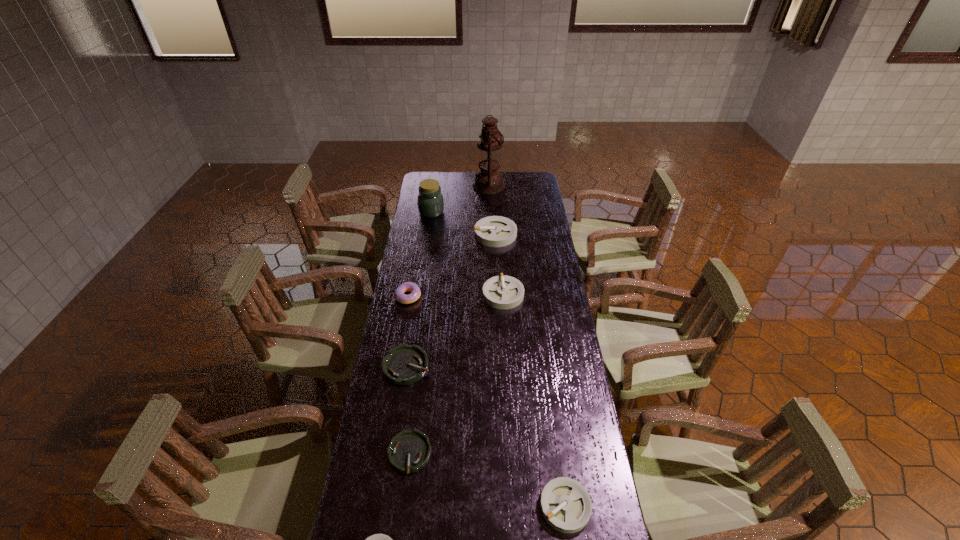
Image resolution: width=960 pixels, height=540 pixels. What are the coordinates of `vacant region located on the left of the second smallest gray ashtray` in the screenshot? It's located at (453, 506).

Find the location of a particular element. The image size is (960, 540). vacant space located on the front of the third farthest ashtray is located at coordinates (401, 401).

Locate an element on the screen. vacant space located 0.080m on the front of the third nearest object is located at coordinates (403, 505).

Locate an element on the screen. object that is at the far edge is located at coordinates (488, 181).

Locate an element on the screen. This screenshot has height=540, width=960. jar situated at the left edge is located at coordinates (430, 200).

The image size is (960, 540). In order to click on doughnut situated at the left edge in this screenshot , I will do tap(411, 287).

Image resolution: width=960 pixels, height=540 pixels. I want to click on object at the right edge, so click(566, 506).

Where is `free spot at the far edge of the desktop`? free spot at the far edge of the desktop is located at coordinates click(x=505, y=187).

Find the location of a particular element. vacant position at the left edge of the desktop is located at coordinates (409, 243).

At what (x,y) coordinates should I click in order to perform the action: click on vacant space at the right edge. Please return your answer as a coordinate pair (x, y). Image resolution: width=960 pixels, height=540 pixels. Looking at the image, I should click on (529, 293).